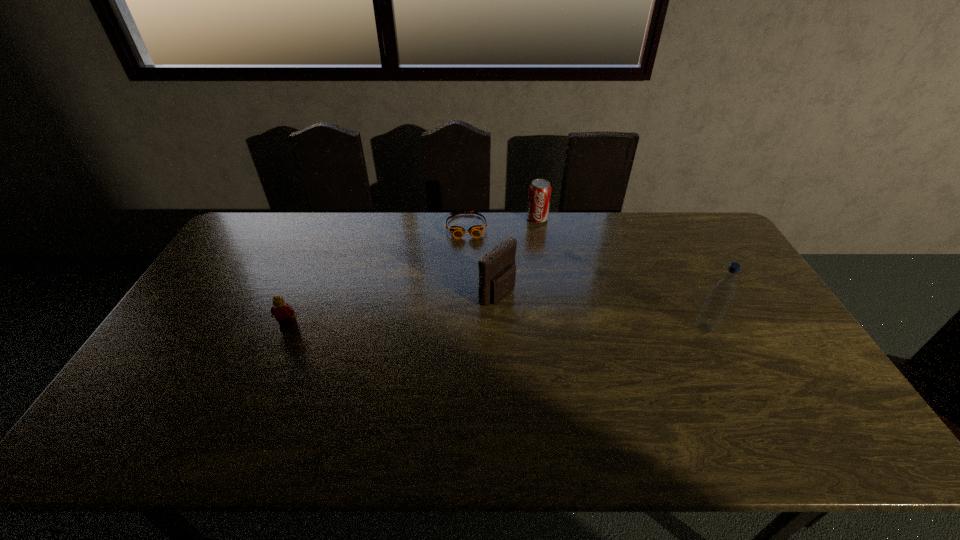
You are a GUI agent. You are given a task and a screenshot of the screen. Output one action in this format:
    pyautogui.click(x=<x>, y=<y>)
    Task: Click on the free space on the desktop that is between the leftmost object and the tallest object and is positioned with an open flap on the third nearest object
    The width and height of the screenshot is (960, 540).
    Given the screenshot: What is the action you would take?
    pyautogui.click(x=554, y=327)

Locate an element on the screen. The height and width of the screenshot is (540, 960). free space on the desktop that is between the Lego and the rightmost object and is positioned with the lenses facing forward on the shortest object is located at coordinates (474, 327).

Image resolution: width=960 pixels, height=540 pixels. What are the coordinates of `vacant space on the desktop that is between the leftmost object and the water bottle and is positioned on the logo side of the third shortest object` in the screenshot? It's located at (533, 327).